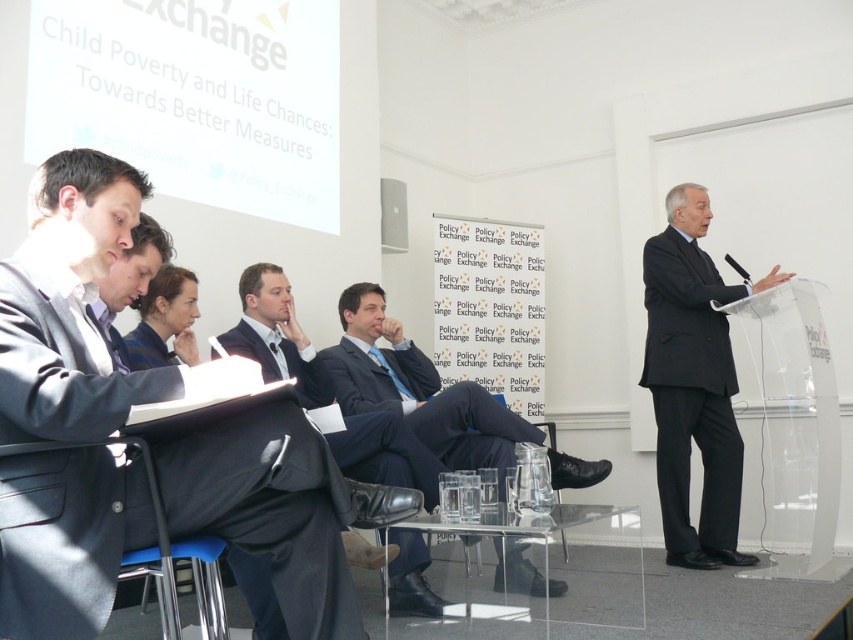
Question: Considering the relative positions of black matte suit at right and matte black suit at center in the image provided, where is black matte suit at right located with respect to matte black suit at center?

Choices:
 (A) left
 (B) right

Answer: (B)

Question: Which point is farther to the camera?

Choices:
 (A) (403, 339)
 (B) (289, 300)

Answer: (A)

Question: Among these objects, which one is farthest from the camera?

Choices:
 (A) matte black suit at center
 (B) black matte suit at right
 (C) dark blue suit at center
 (D) matte black suit at left

Answer: (B)

Question: Which point appears farthest from the camera in this image?

Choices:
 (A) (682, 500)
 (B) (471, 456)
 (C) (369, 452)

Answer: (A)

Question: Does matte black suit at left have a larger size compared to black matte suit at right?

Choices:
 (A) no
 (B) yes

Answer: (A)

Question: Is the position of black matte suit at right more distant than that of dark blue suit at center?

Choices:
 (A) no
 (B) yes

Answer: (B)